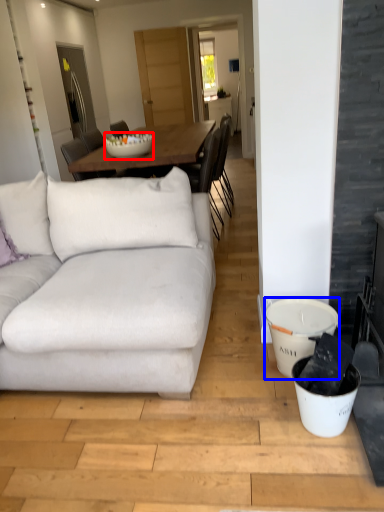
Question: Which of the following is the farthest to the observer, bowl (highlighted by a red box) or bucket (highlighted by a blue box)?

Choices:
 (A) bowl
 (B) bucket

Answer: (A)